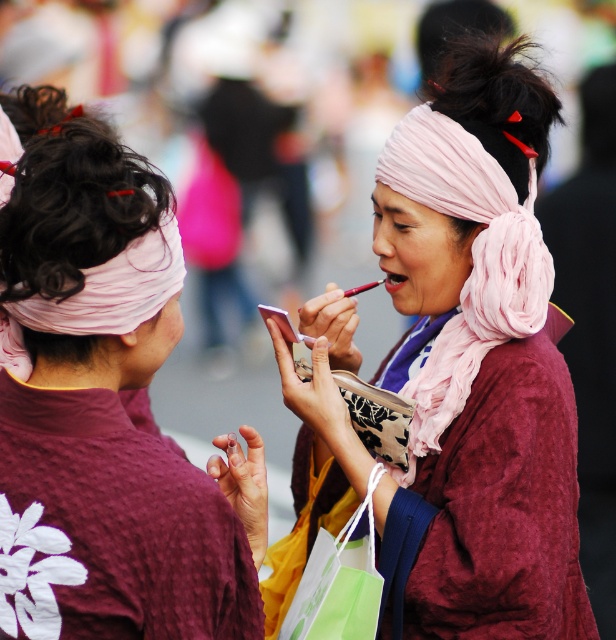
Question: Which point is closer to the camera?

Choices:
 (A) (387, 276)
 (B) (99, 452)
 (C) (456, 353)
 (D) (34, 433)

Answer: (B)

Question: Estimate the real-world distances between objects in this image. Which object is closer to the matte pink lipstick at center?

Choices:
 (A) pink silk scarf at center
 (B) pink fabric headscarf at center
 (C) maroon textured robe at back

Answer: (B)

Question: Does maroon textured robe at back have a lesser width compared to pink fabric headscarf at center?

Choices:
 (A) no
 (B) yes

Answer: (A)

Question: Can you confirm if matte pink kimono at center is positioned to the left of pink fabric headscarf at center?

Choices:
 (A) no
 (B) yes

Answer: (B)

Question: Does pink silk scarf at center have a lesser width compared to pink fabric headscarf at center?

Choices:
 (A) yes
 (B) no

Answer: (B)

Question: Which point appears farthest from the camera in this image?

Choices:
 (A) (466, 180)
 (B) (450, 362)
 (C) (201, 522)

Answer: (B)